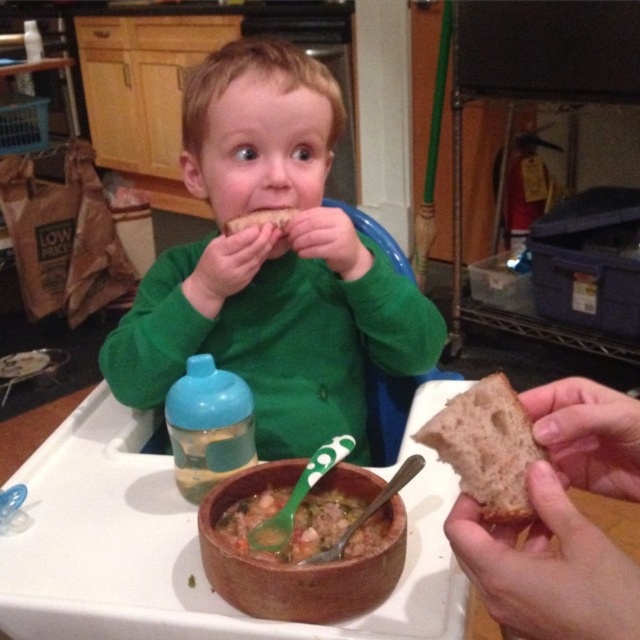
Between point (257, 198) and point (317, 548), which one is positioned in front?

Point (317, 548)

At what (x,y) coordinates should I click in order to perform the action: click on green matte shirt at center. Please return your answer as a coordinate pair (x, y). The image size is (640, 640). Looking at the image, I should click on (272, 262).

Locate an element on the screen. green matte shirt at center is located at coordinates (272, 262).

Is green matte shirt at center above brown clay bowl at lower center?

Correct, green matte shirt at center is located above brown clay bowl at lower center.

Does green matte shirt at center lie in front of brown clay bowl at lower center?

No, green matte shirt at center is further to the viewer.

Is point (125, 321) more distant than point (330, 620)?

Yes.

What are the coordinates of `green matte shirt at center` in the screenshot? It's located at (272, 262).

Is brown matte bread at right thinner than blue plastic bottle at lower left?

Correct, brown matte bread at right's width is less than blue plastic bottle at lower left's.

I want to click on brown matte bread at right, so click(486, 448).